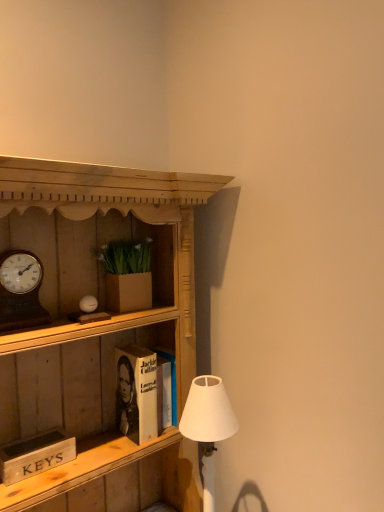
At what (x,y) coordinates should I click in order to perform the action: click on wooden cabinet at center. Please return your answer as a coordinate pair (x, y). Looking at the image, I should click on (98, 327).

This screenshot has width=384, height=512. What do you see at coordinates (20, 291) in the screenshot? I see `wooden clock at left` at bounding box center [20, 291].

The image size is (384, 512). Describe the element at coordinates (127, 274) in the screenshot. I see `brown cardboard box at upper center` at that location.

What do you see at coordinates (136, 393) in the screenshot?
I see `hardcover book at center, which is counted as the first book, starting from the back` at bounding box center [136, 393].

Measure the distance between white matte lampshade at lower right and camera.

white matte lampshade at lower right and camera are 37.44 inches apart from each other.

You are a GUI agent. You are given a task and a screenshot of the screen. Output one action in this format:
    pyautogui.click(x=<x>, y=<y>)
    Task: Click on the wooden cabinet at center
    
    Given the screenshot: What is the action you would take?
    pyautogui.click(x=98, y=327)

From a real-world perspective, does white matte lampshade at lower right stand above brown cardboard box at upper center?

Actually, white matte lampshade at lower right is physically below brown cardboard box at upper center in the real world.

Is the position of white matte lampshade at lower right more distant than that of brown cardboard box at upper center?

No, white matte lampshade at lower right is closer to the camera.

Is white matte lampshade at lower right positioned with its back to brown cardboard box at upper center?

That's not correct — white matte lampshade at lower right is not looking away from brown cardboard box at upper center.

Between white matte lampshade at lower right and brown cardboard box at upper center, which one has larger width?

white matte lampshade at lower right.

Is wooden clock at left at the back of white matte lampshade at lower right?

That's not correct — white matte lampshade at lower right is not looking away from wooden clock at left.

Is white matte lampshade at lower right to the right of wooden clock at left from the viewer's perspective?

Yes, white matte lampshade at lower right is to the right of wooden clock at left.

Which is closer, (207, 382) or (18, 269)?

The point (18, 269) is closer to the camera.

From the image's perspective, between white matte lampshade at lower right and wooden clock at left, which one is located above?

wooden clock at left, from the image's perspective.

Find the location of a particular element. The image size is (384, 512). cabinetry above the white matte lampshade at lower right (from a real-world perspective) is located at coordinates coord(98,327).

From a real-world perspective, which object rests below the other?

white matte lampshade at lower right.

Is wooden cabinet at center next to white matte lampshade at lower right and touching it?

No, wooden cabinet at center is not with white matte lampshade at lower right.

How different are the orientations of white matte lampshade at lower right and hardcover book at center, the second book viewed from the left, in degrees?

The angular difference between white matte lampshade at lower right and hardcover book at center, the second book viewed from the left, is 1.47 degrees.

Which is in front, white matte lampshade at lower right or hardcover book at center, arranged as the second book when viewed from the front?

white matte lampshade at lower right is more forward.

Is white matte lampshade at lower right next to hardcover book at center, which is counted as the first book, starting from the back, and touching it?

white matte lampshade at lower right and hardcover book at center, which is counted as the first book, starting from the back, are clearly separated.

From the image's perspective, is white matte lampshade at lower right over hardcover book at center, which is counted as the first book, starting from the back?

No, from the image's perspective, white matte lampshade at lower right is not over hardcover book at center, which is counted as the first book, starting from the back.

Is wooden clock at left bigger or smaller than hardcover book at center, the second book viewed from the left?

wooden clock at left is smaller than hardcover book at center, the second book viewed from the left.

Which object is thinner, wooden clock at left or hardcover book at center, the second book viewed from the left?

Thinner between the two is wooden clock at left.

Considering the sizes of objects wooden clock at left and hardcover book at center, the second book viewed from the left, in the image provided, who is taller, wooden clock at left or hardcover book at center, the second book viewed from the left,?

hardcover book at center, the second book viewed from the left, is taller.

Can you tell me how much wooden cabinet at center and brown cardboard box at upper center differ in facing direction?

1.47 degrees.

Image resolution: width=384 pixels, height=512 pixels. Find the location of `houseplant above the wooden cabinet at center (from the image's perspective)`. houseplant above the wooden cabinet at center (from the image's perspective) is located at coordinates coord(127,274).

Considering the sizes of objects wooden cabinet at center and brown cardboard box at upper center in the image provided, who is taller, wooden cabinet at center or brown cardboard box at upper center?

Standing taller between the two is wooden cabinet at center.

Does hardcover book at center, arranged as the second book when viewed from the front, have a smaller size compared to wooden cabinet at center?

Correct, hardcover book at center, arranged as the second book when viewed from the front, occupies less space than wooden cabinet at center.

Which is correct: hardcover book at center, the second book viewed from the left, is inside wooden cabinet at center, or outside of it?

The correct answer is: inside.

Does hardcover book at center, arranged as the second book when viewed from the front, turn towards wooden cabinet at center?

Yes, hardcover book at center, arranged as the second book when viewed from the front, is aimed at wooden cabinet at center.

Which object is further away from the camera, hardcover book at center, the second book viewed from the left, or wooden cabinet at center?

Positioned behind is hardcover book at center, the second book viewed from the left.

Locate an element on the screen. The height and width of the screenshot is (512, 384). houseplant above the white matte lampshade at lower right (from a real-world perspective) is located at coordinates (127, 274).

This screenshot has width=384, height=512. I want to click on clock behind the white matte lampshade at lower right, so click(x=20, y=291).

Which object lies nearer to the anchor point hardcover book at center, arranged as the second book when viewed from the front, brown cardboard box at upper center or white matte lampshade at lower right?

white matte lampshade at lower right is closer to hardcover book at center, arranged as the second book when viewed from the front.

From the image, which object appears to be farther from wooden clock at left, white matte lampshade at lower right or wooden cabinet at center?

white matte lampshade at lower right.

Which object lies further to the anchor point brown cardboard box at upper center, hardcover book at center, arranged as the second book when viewed from the front, or wooden clock at left?

Based on the image, wooden clock at left appears to be further to brown cardboard box at upper center.

Estimate the real-world distances between objects in this image. Which object is further from wooden cabinet at center, brown cardboard box at upper center or hardcover book at center, the second book viewed from the left?

Among the two, brown cardboard box at upper center is located further to wooden cabinet at center.

Looking at the image, which one is located closer to white matte lampshade at lower right, wooden clock at left or wooden signboard at lower left, which is the second book from back to front?

wooden signboard at lower left, which is the second book from back to front.

Which object lies further to the anchor point brown cardboard box at upper center, wooden cabinet at center or white matte lampshade at lower right?

white matte lampshade at lower right is further to brown cardboard box at upper center.

Based on their spatial positions, is wooden clock at left or white matte lampshade at lower right closer to wooden cabinet at center?

The object closer to wooden cabinet at center is wooden clock at left.

Based on the photo, considering their positions, is brown cardboard box at upper center positioned further to white matte lampshade at lower right than wooden clock at left?

Based on the image, wooden clock at left appears to be further to white matte lampshade at lower right.

The width and height of the screenshot is (384, 512). Find the location of `houseplant between wooden cabinet at center and hardcover book at center, arranged as the second book when viewed from the front, in the front-back direction`. houseplant between wooden cabinet at center and hardcover book at center, arranged as the second book when viewed from the front, in the front-back direction is located at coordinates (127, 274).

Locate an element on the screen. clock that lies between brown cardboard box at upper center and white matte lampshade at lower right from top to bottom is located at coordinates (20, 291).

Locate an element on the screen. lamp between wooden cabinet at center and brown cardboard box at upper center in the front-back direction is located at coordinates (208, 426).

Where is `lamp positioned between wooden cabinet at center and hardcover book at center, which is counted as the first book, starting from the back, from near to far`? Image resolution: width=384 pixels, height=512 pixels. lamp positioned between wooden cabinet at center and hardcover book at center, which is counted as the first book, starting from the back, from near to far is located at coordinates (208, 426).